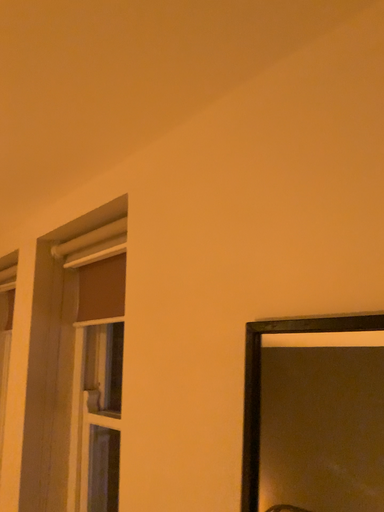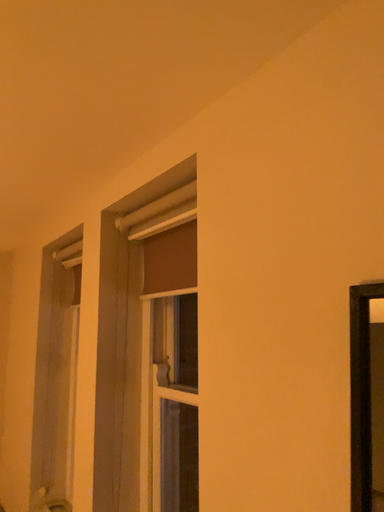
Question: Which way did the camera rotate in the video?

Choices:
 (A) rotated left
 (B) rotated right

Answer: (A)